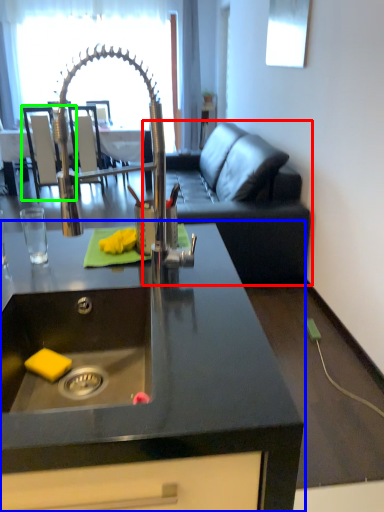
Question: Considering the real-world distances, which object is farthest from studio couch (highlighted by a red box)? countertop (highlighted by a blue box) or armchair (highlighted by a green box)?

Choices:
 (A) countertop
 (B) armchair

Answer: (A)